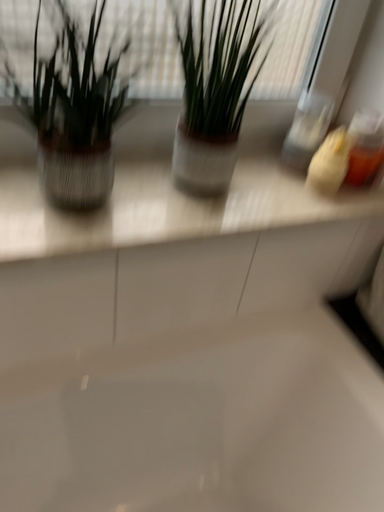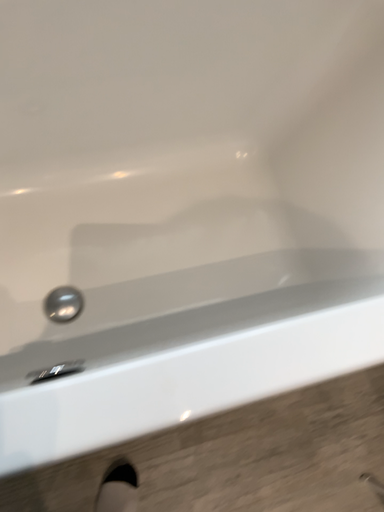
Question: How did the camera likely rotate when shooting the video?

Choices:
 (A) rotated downward
 (B) rotated upward

Answer: (A)